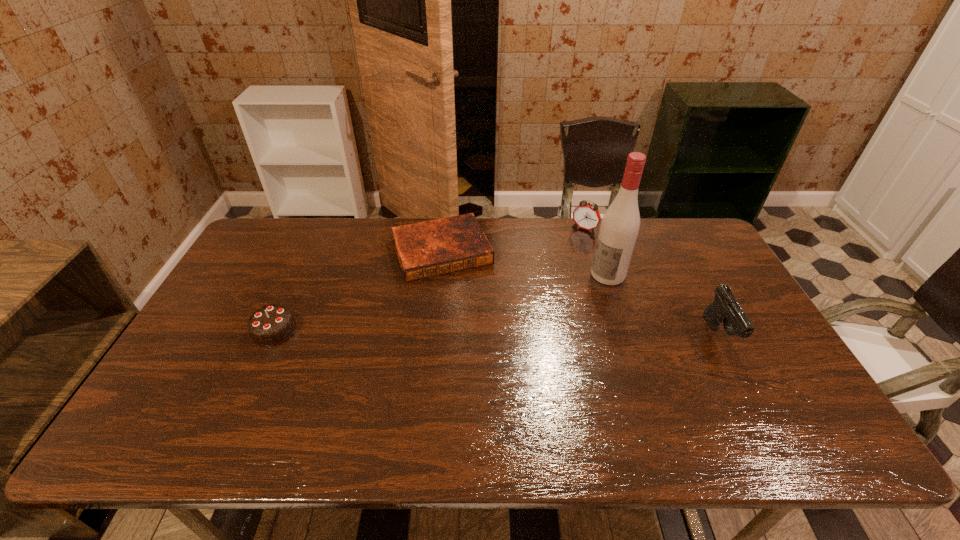
Locate an element on the screen. This screenshot has width=960, height=540. chocolate cake is located at coordinates (271, 325).

This screenshot has height=540, width=960. I want to click on the fourth tallest object, so click(271, 325).

Where is `pistol`? This screenshot has width=960, height=540. pistol is located at coordinates (725, 308).

Identify the location of the tallest object. This screenshot has width=960, height=540. [619, 228].

I want to click on the fourth object from right to left, so click(x=436, y=247).

This screenshot has height=540, width=960. I want to click on Bible, so click(x=436, y=247).

In order to click on alarm clock in this screenshot , I will do `click(586, 216)`.

Identify the location of free space located on the back of the chocolate cake. The height and width of the screenshot is (540, 960). click(x=315, y=241).

I want to click on vacant space located 0.080m at the barrel of the rightmost object, so click(x=746, y=387).

In order to click on vacant area situated 0.340m on the label of the alcohol in this screenshot , I will do [x=521, y=338].